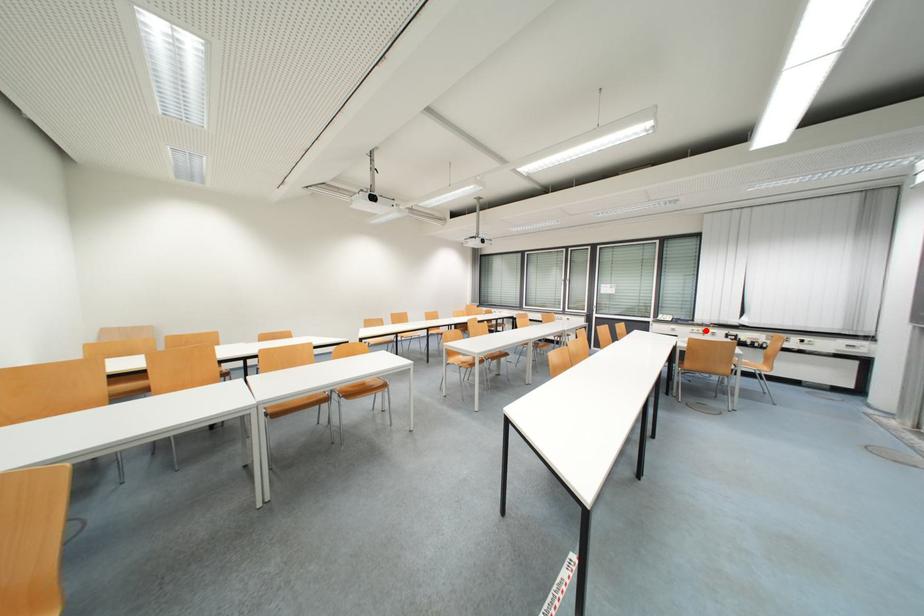
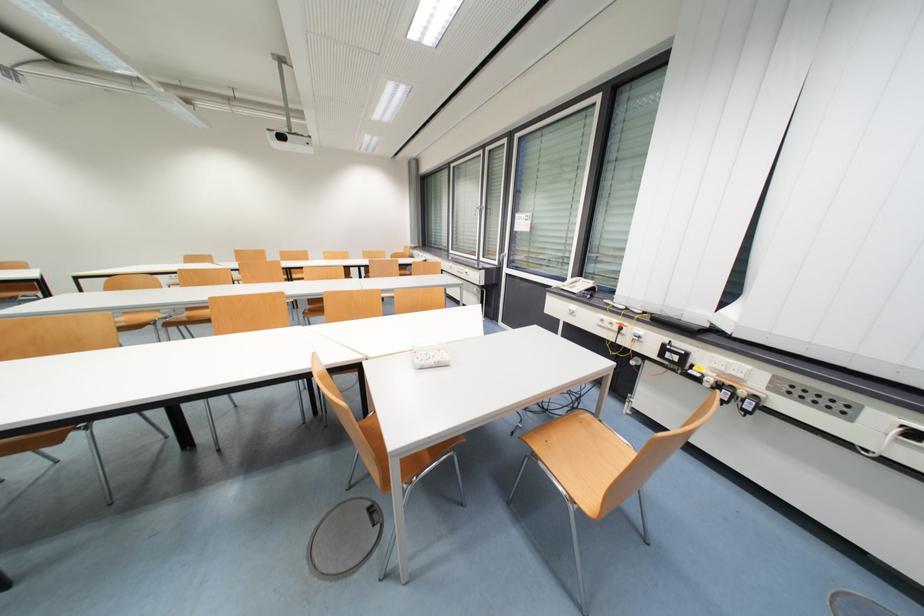
Where in the second image is the point corresponding to the highlighted location from the first image?

(622, 323)